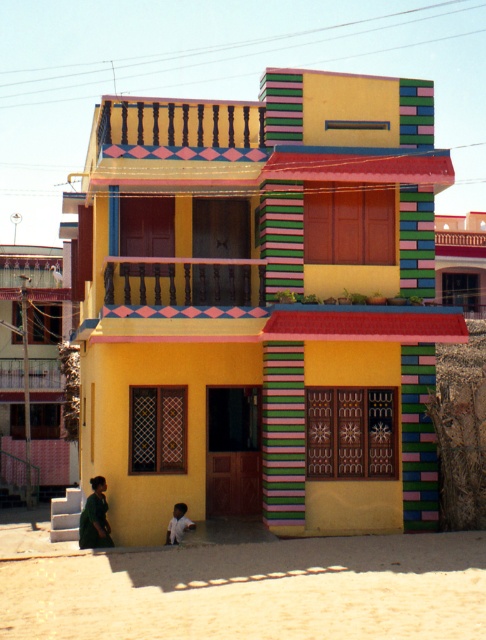
Question: Which object is farther from the camera taking this photo?

Choices:
 (A) green matte dress at lower left
 (B) beige sandy ground at lower center

Answer: (A)

Question: Which object is closer to the camera taking this photo?

Choices:
 (A) light blue fabric shirt at lower center
 (B) beige sandy ground at lower center
 (C) green matte dress at lower left

Answer: (B)

Question: Does beige sandy ground at lower center have a smaller size compared to green matte dress at lower left?

Choices:
 (A) yes
 (B) no

Answer: (B)

Question: Can you confirm if beige sandy ground at lower center is positioned to the left of green matte dress at lower left?

Choices:
 (A) no
 (B) yes

Answer: (A)

Question: Is beige sandy ground at lower center above green matte dress at lower left?

Choices:
 (A) no
 (B) yes

Answer: (B)

Question: Which point appears farthest from the camera in this image?

Choices:
 (A) (94, 522)
 (B) (379, 595)

Answer: (A)